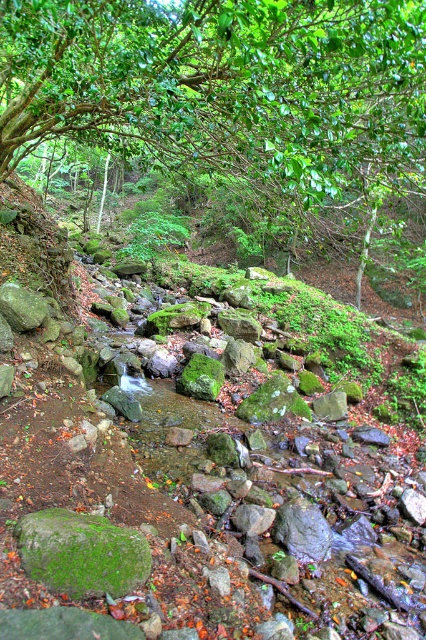
Does green leafy tree at upper center lie behind green mossy rock at center?

Yes, it is.

Which is above, green leafy tree at upper center or green mossy rock at center?

green leafy tree at upper center is above.

Which is behind, point (2, 51) or point (92, 556)?

The point (2, 51) is behind.

This screenshot has height=640, width=426. I want to click on green leafy tree at upper center, so (x=227, y=88).